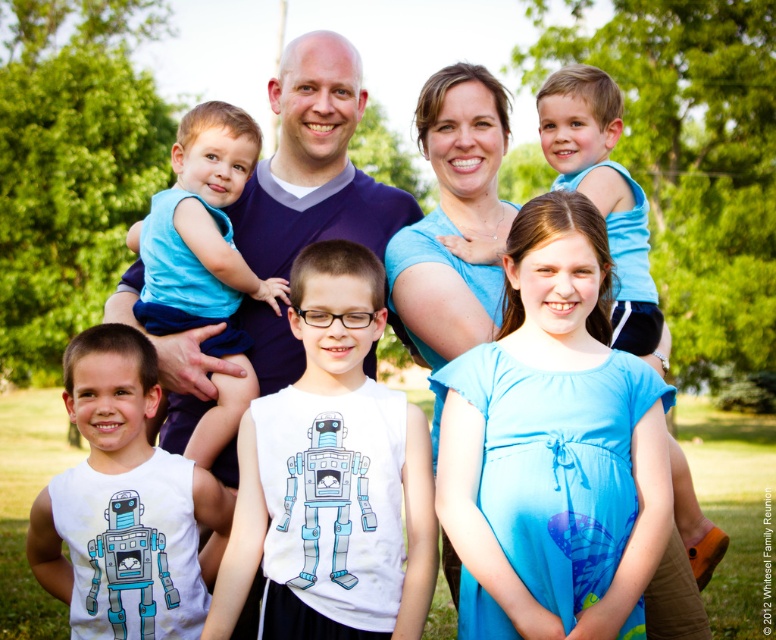
Question: Estimate the real-world distances between objects in this image. Which object is farther from the light blue fabric shirt at upper right?

Choices:
 (A) blue sleeveless shirt at upper left
 (B) white matte robot shirt at lower left
 (C) white matte tank top at center

Answer: (B)

Question: Considering the real-world distances, which object is closest to the blue sleeveless shirt at upper left?

Choices:
 (A) white matte tank top at center
 (B) white matte robot shirt at lower left
 (C) light blue fabric shirt at upper right

Answer: (A)

Question: Is white matte tank top at center wider than blue sleeveless shirt at upper left?

Choices:
 (A) no
 (B) yes

Answer: (B)

Question: Can you confirm if blue sleeveless shirt at upper left is smaller than light blue fabric shirt at upper right?

Choices:
 (A) no
 (B) yes

Answer: (B)

Question: Which object is the farthest from the white matte robot shirt at lower left?

Choices:
 (A) white matte tank top at center
 (B) light blue fabric shirt at upper right
 (C) blue sleeveless shirt at upper left

Answer: (B)

Question: Is blue sleeveless shirt at upper left bigger than light blue fabric shirt at upper right?

Choices:
 (A) yes
 (B) no

Answer: (B)